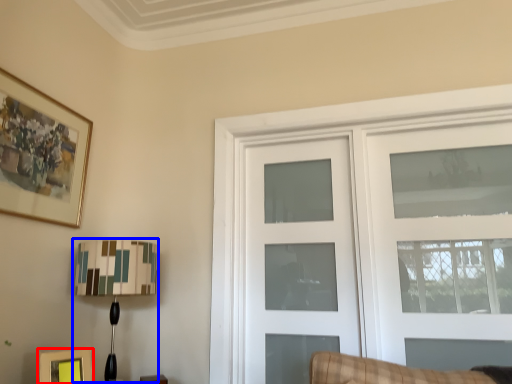
Question: Which object appears closest to the camera in this image, picture frame (highlighted by a red box) or table lamp (highlighted by a blue box)?

Choices:
 (A) picture frame
 (B) table lamp

Answer: (A)